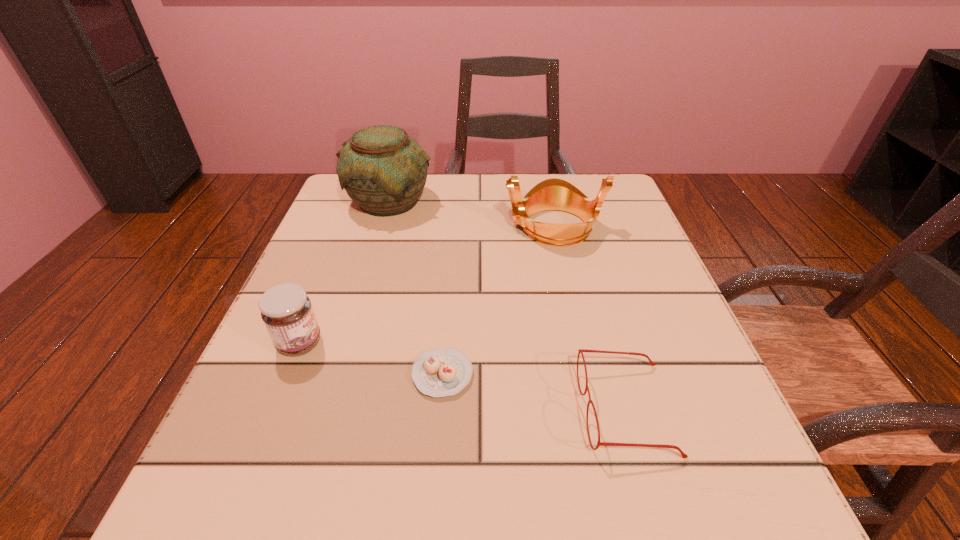
You are a GUI agent. You are given a task and a screenshot of the screen. Output one action in this format:
    pyautogui.click(x=<x>, y=<y>)
    Task: Click on the free space that is in between the third tallest object and the cupcake
    
    Given the screenshot: What is the action you would take?
    pyautogui.click(x=372, y=359)

I want to click on free space that is in between the second shortest object and the tiara, so click(590, 318).

The height and width of the screenshot is (540, 960). I want to click on vacant region between the jam and the tallest object, so click(345, 272).

Identify the location of free area in between the third object from right to left and the fourth shortest object. pyautogui.click(x=498, y=300).

What are the coordinates of `vacant area that lies between the shortest object and the second tallest object` in the screenshot? It's located at (498, 300).

At what (x,y) coordinates should I click in order to perform the action: click on free space between the tallest object and the shortest object. Please return your answer as a coordinate pair (x, y). The width and height of the screenshot is (960, 540). Looking at the image, I should click on (417, 288).

Where is `empty location between the fourth shortest object and the pottery`? This screenshot has height=540, width=960. empty location between the fourth shortest object and the pottery is located at coordinates tap(472, 214).

Where is `free space between the spectacles and the third object from right to left`? This screenshot has height=540, width=960. free space between the spectacles and the third object from right to left is located at coordinates (535, 392).

Identify the location of vacant point located between the third tallest object and the pottery. (345, 272).

The height and width of the screenshot is (540, 960). In order to click on object that is the closest to the pottery in this screenshot , I will do `click(552, 194)`.